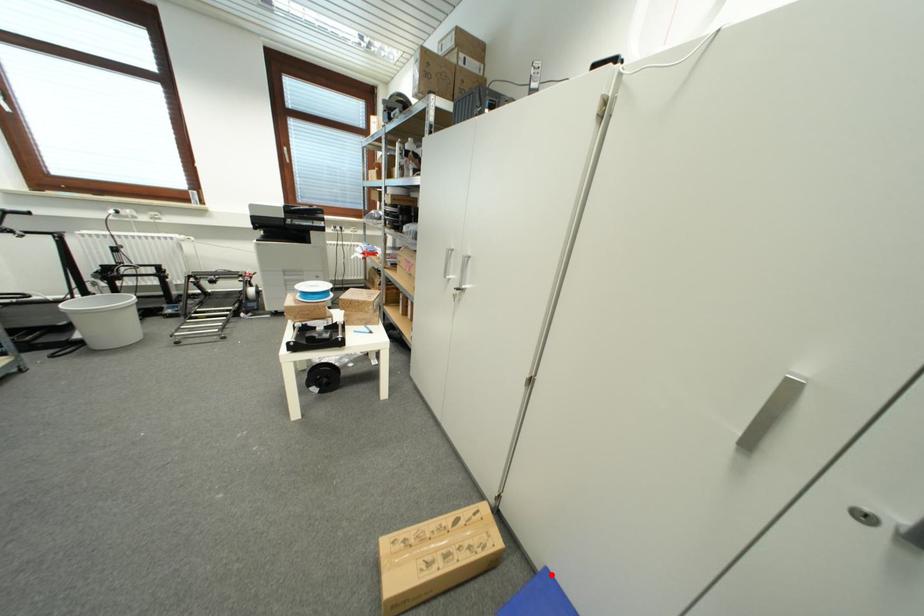
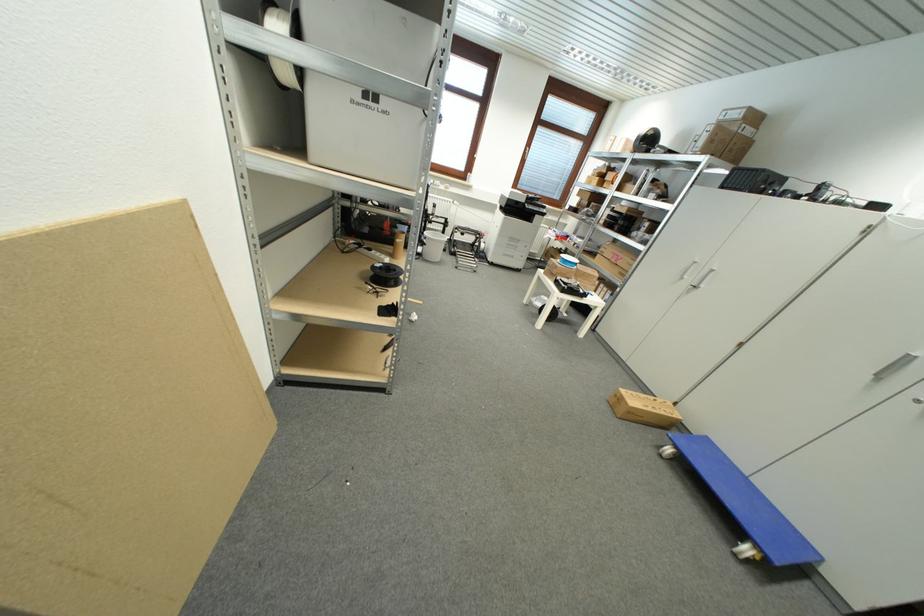
Locate, in the second image, the point that corresponds to the highlighted location in the first image.

(711, 440)